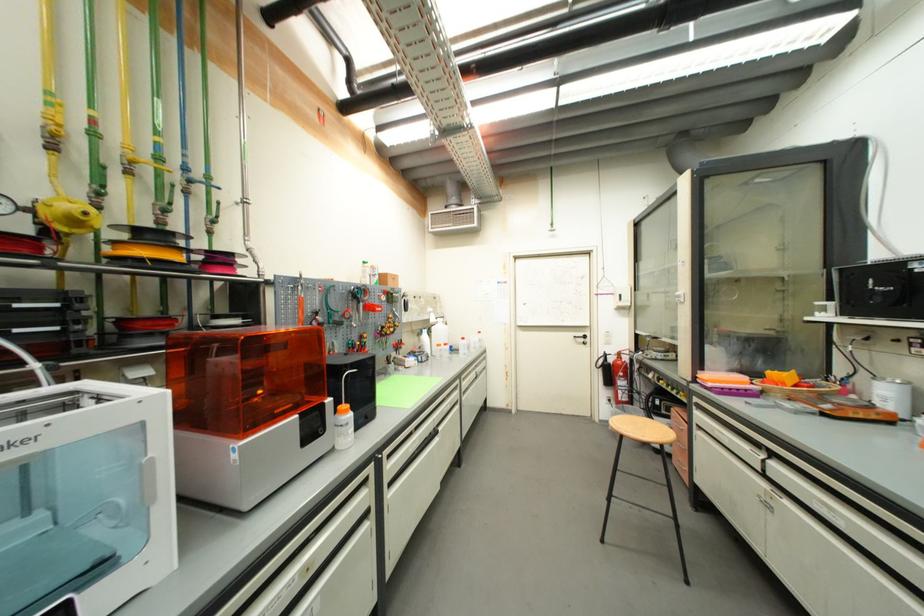
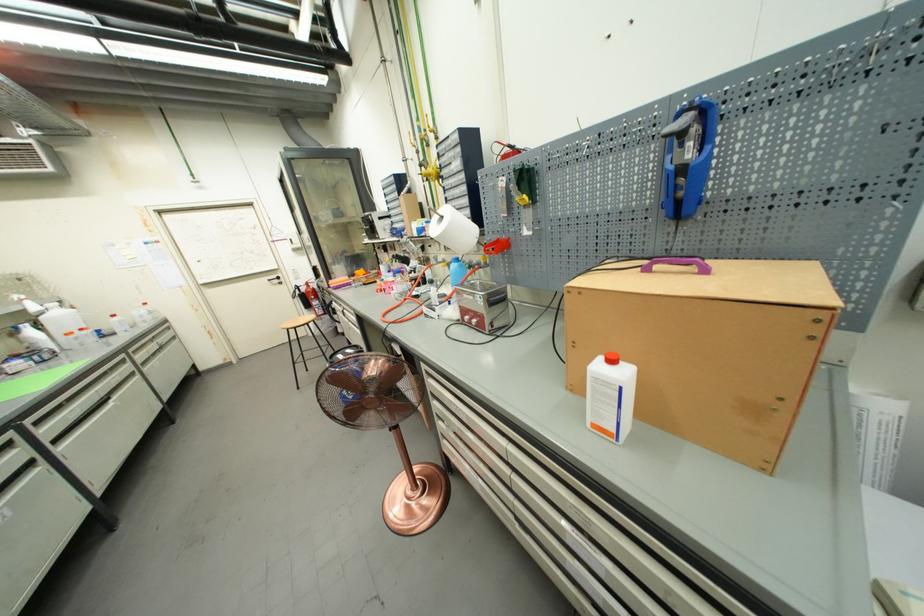
Find the pixel in the second image that matches the point at 616,361 in the first image.

(309, 291)